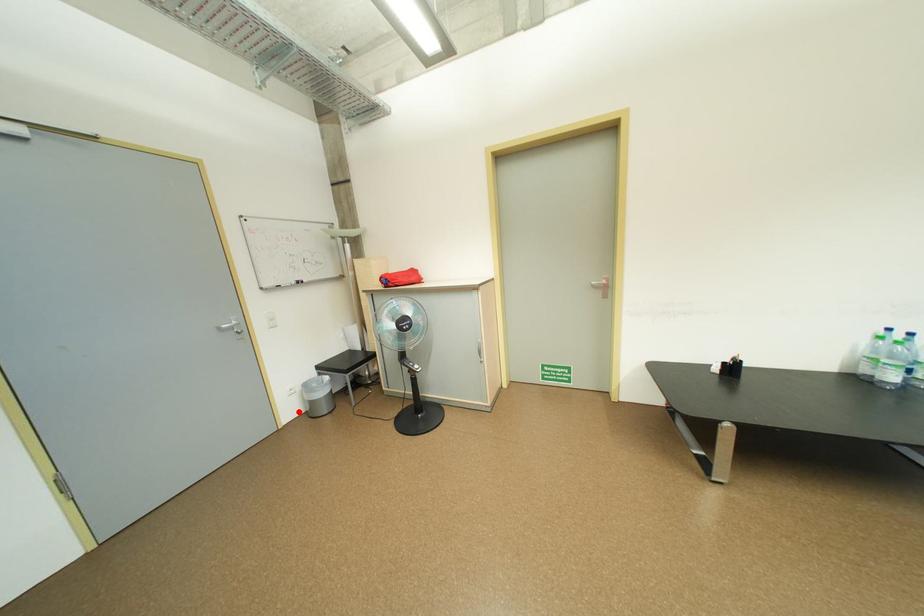
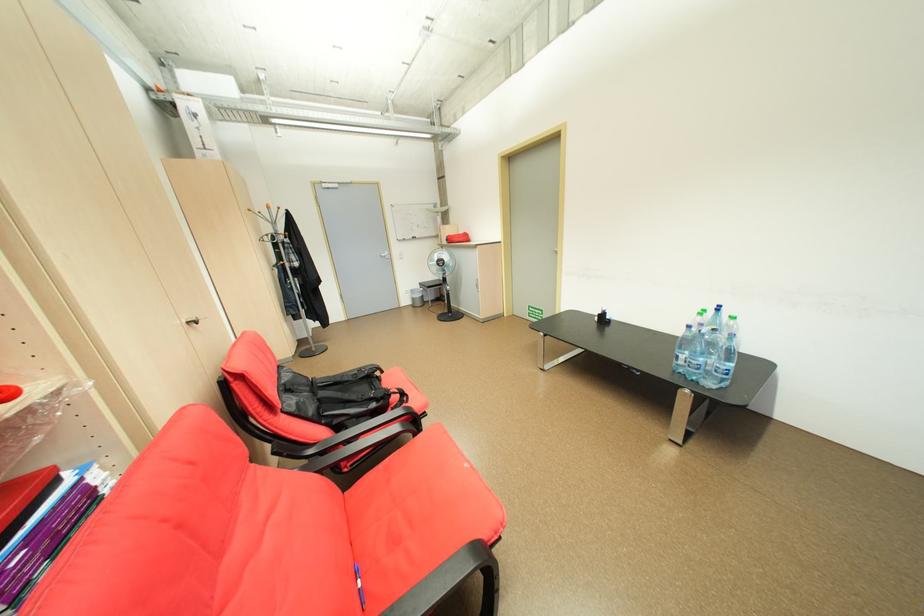
Locate, in the second image, the point that corresponds to the highlighted location in the first image.

(415, 302)